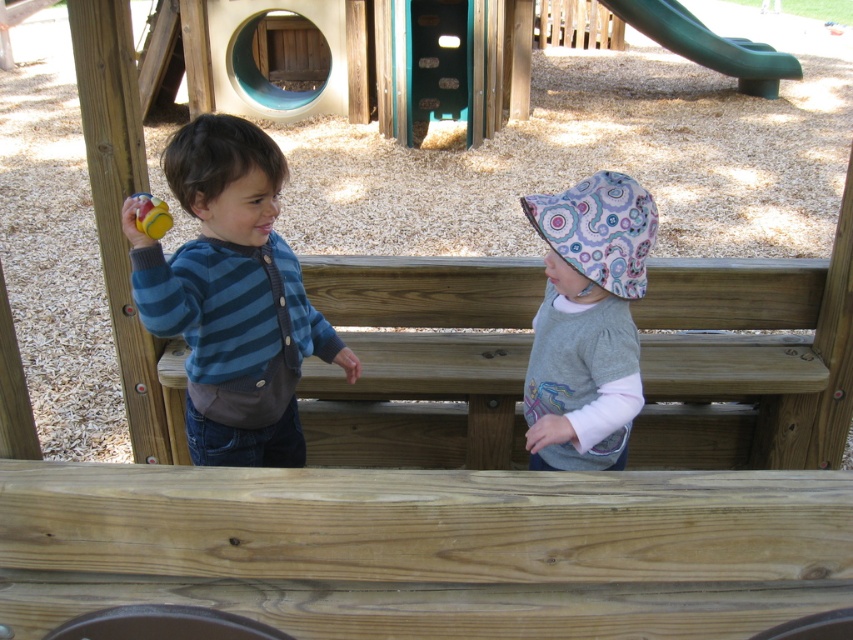
Which is behind, point (216, 154) or point (154, 228)?

Positioned behind is point (216, 154).

You are a GUI agent. You are given a task and a screenshot of the screen. Output one action in this format:
    pyautogui.click(x=<x>, y=<y>)
    Task: Click on the blue striped sweater at left
    The width and height of the screenshot is (853, 640).
    Given the screenshot: What is the action you would take?
    pyautogui.click(x=231, y=296)

Is patterned fabric hat at center positioned at the back of yellow rubber ball at left?

Yes, patterned fabric hat at center is behind yellow rubber ball at left.

Is patterned fabric hat at center bigger than yellow rubber ball at left?

Yes.

Between point (633, 257) and point (151, 236), which one is positioned behind?

Point (633, 257)

This screenshot has height=640, width=853. I want to click on patterned fabric hat at center, so click(x=587, y=323).

Based on the photo, is blue striped sweater at left bigger than green plastic slide at upper right?

No, blue striped sweater at left is not bigger than green plastic slide at upper right.

The image size is (853, 640). What are the coordinates of `blue striped sweater at left` in the screenshot? It's located at (231, 296).

Between point (245, 212) and point (740, 61), which one is positioned in front?

Point (245, 212)

Where is `blue striped sweater at left`? This screenshot has width=853, height=640. blue striped sweater at left is located at coordinates (231, 296).